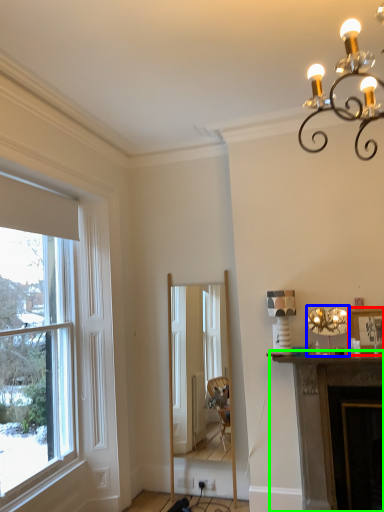
Question: Which object is positioned closest to picture frame (highlighted by a red box)? Select from lamp (highlighted by a blue box) and fireplace (highlighted by a green box).

Choices:
 (A) lamp
 (B) fireplace

Answer: (A)